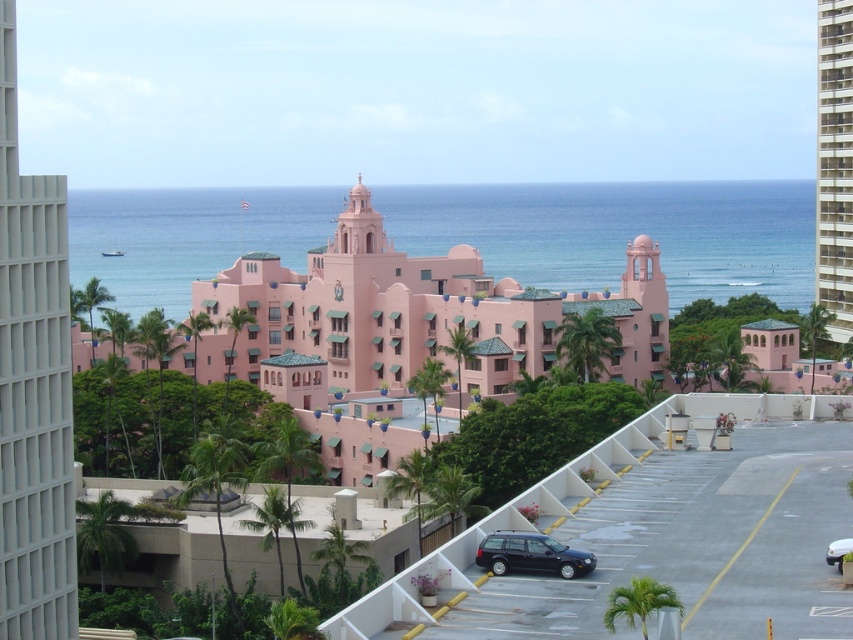
Is point (22, 483) positioned behind point (846, 301)?

No.

Is matte pink building at left below pink concrete building at right?

Yes.

Is point (7, 314) positioned behind point (825, 228)?

That is False.

Locate an element on the screen. matte pink building at left is located at coordinates (32, 387).

Between matte pink building at left and matte black car at center, which one appears on the right side from the viewer's perspective?

Positioned to the right is matte black car at center.

Does matte pink building at left appear over matte black car at center?

Correct, matte pink building at left is located above matte black car at center.

You are a GUI agent. You are given a task and a screenshot of the screen. Output one action in this format:
    pyautogui.click(x=<x>, y=<y>)
    Task: Click on the matte pink building at left
    
    Given the screenshot: What is the action you would take?
    pyautogui.click(x=32, y=387)

Between point (705, 252) and point (840, 541), which one is positioned in front?

Positioned in front is point (840, 541).

Who is higher up, blue water at center or matte black car at center?

blue water at center is above.

Does point (494, 221) lie behind point (843, 554)?

Yes, point (494, 221) is farther from viewer.

At what (x,y) coordinates should I click in order to perform the action: click on blue water at center. Please return your answer as a coordinate pair (x, y). This screenshot has width=853, height=640. Looking at the image, I should click on (619, 232).